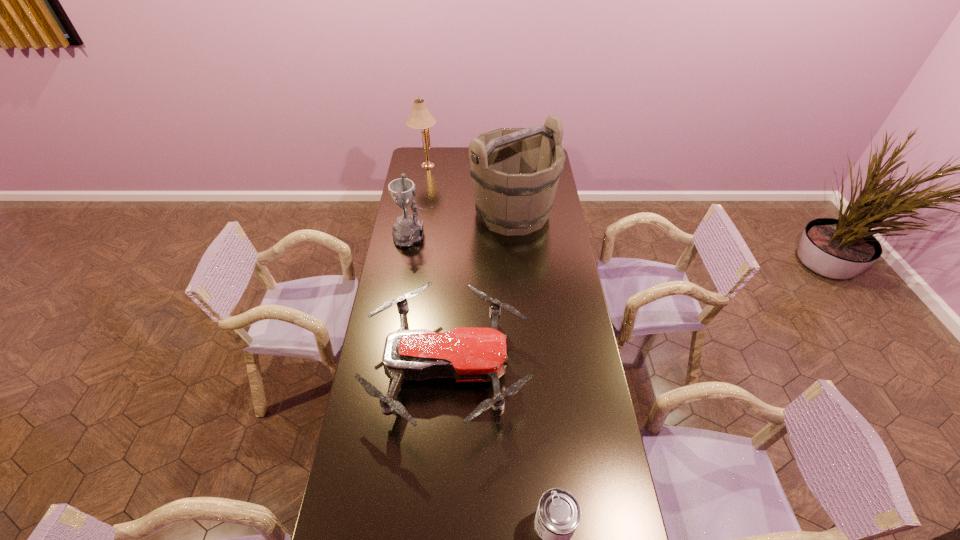
Identify the location of bucket. The width and height of the screenshot is (960, 540). (515, 172).

The height and width of the screenshot is (540, 960). Find the location of `lampshade`. lampshade is located at coordinates (420, 118).

This screenshot has width=960, height=540. I want to click on the third shortest object, so click(408, 230).

Locate an element on the screen. the second nearest object is located at coordinates (468, 354).

Where is `free space located on the left of the bucket`? The height and width of the screenshot is (540, 960). free space located on the left of the bucket is located at coordinates (404, 213).

Where is `free region located on the right of the lampshade`? free region located on the right of the lampshade is located at coordinates (504, 165).

The width and height of the screenshot is (960, 540). Identify the location of vacant point located on the side with emblem of the third shortest object. (519, 236).

In order to click on free space located on the front-facing side of the second nearest object in this screenshot , I will do `click(582, 368)`.

You are a GUI agent. You are given a task and a screenshot of the screen. Output one action in this format:
    pyautogui.click(x=<x>, y=<y>)
    Task: Click on the object positioned at the far edge
    This screenshot has height=540, width=960.
    Given the screenshot: What is the action you would take?
    pyautogui.click(x=420, y=118)

The width and height of the screenshot is (960, 540). Identify the location of lampshade located in the left edge section of the desktop. (420, 118).